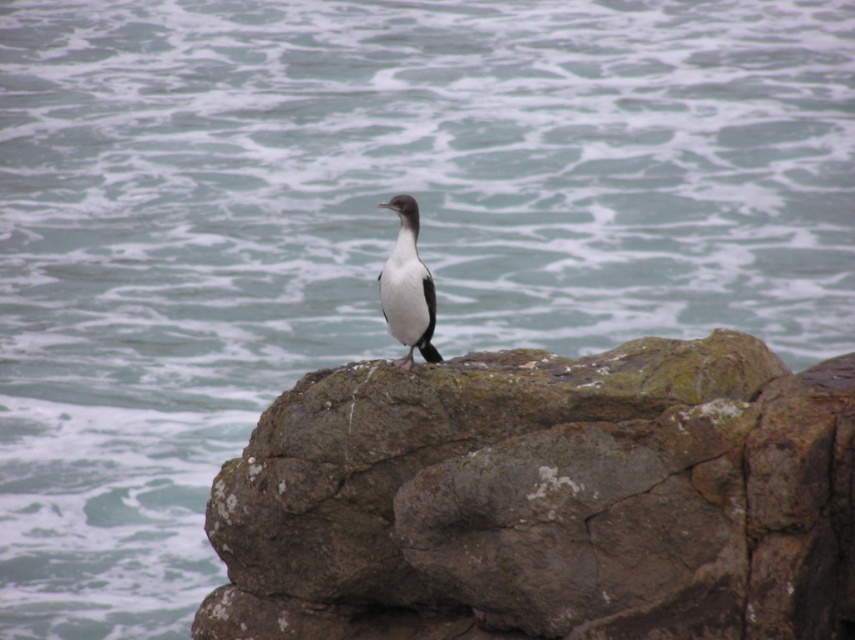
Does rough textured rock at center lie behind white glossy bird at center?

No, it is not.

Who is positioned more to the right, rough textured rock at center or white glossy bird at center?

rough textured rock at center

What do you see at coordinates (544, 499) in the screenshot? This screenshot has width=855, height=640. I see `rough textured rock at center` at bounding box center [544, 499].

At what (x,y) coordinates should I click in order to perform the action: click on rough textured rock at center. Please return your answer as a coordinate pair (x, y). Looking at the image, I should click on (544, 499).